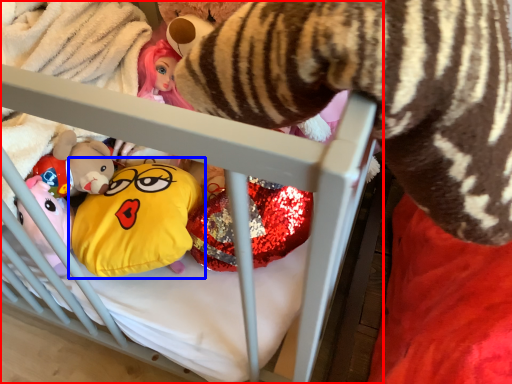
Question: Among these objects, which one is nearest to the camera, infant bed (highlighted by a red box) or toy (highlighted by a blue box)?

Choices:
 (A) infant bed
 (B) toy

Answer: (A)